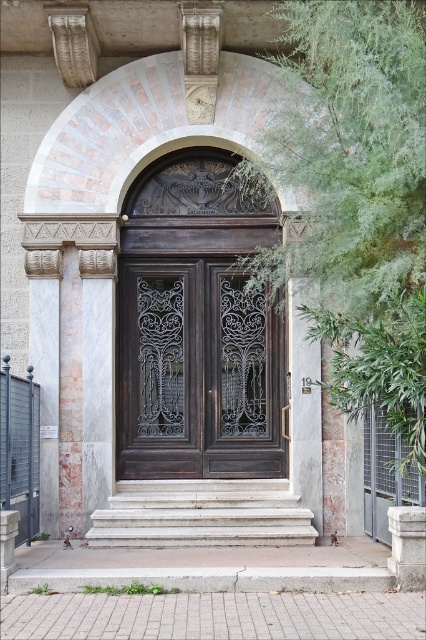
You are standing in front of the grand entrance and need to determine which object is narrower between the dark wood door at center and the white marble stairs at center. Which one is narrower?

The dark wood door at center is narrower than the white marble stairs at center.

You are at the entrance of a building and see the dark wood door at center and the white marble stairs at center. Which one is positioned higher in the image?

The dark wood door at center is located above the white marble stairs at center, so the dark wood door at center is positioned higher in the image.

You are standing in front of the grand entrance door and want to place a small decoration between the two points, point (189, 365) and point (66, 422). Which point should the decoration be closer to in order to be placed behind the closer point?

The decoration should be closer to point (66, 422) because point (189, 365) is behind point (66, 422), meaning the closer point is point (66, 422).